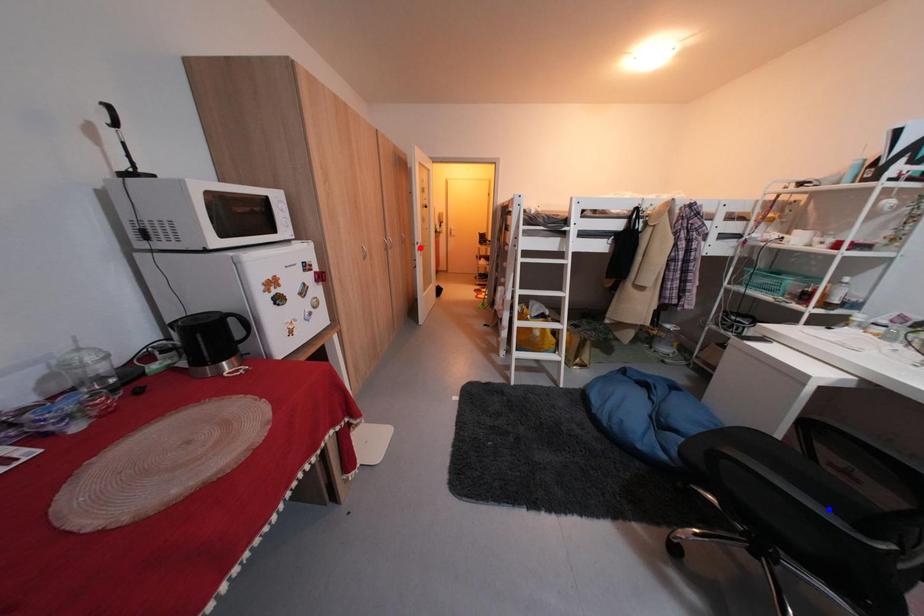
Question: Two points are marked on the image. Which point is closer to the camera?

Choices:
 (A) Blue point is closer.
 (B) Red point is closer.

Answer: (A)